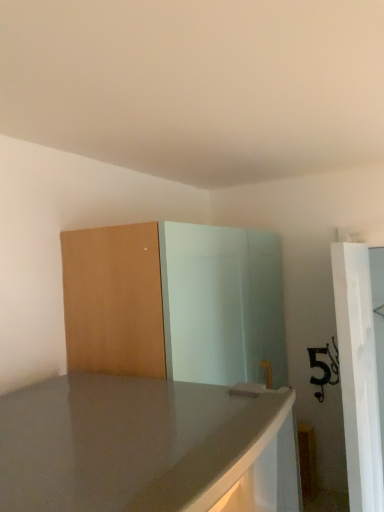
Question: From their relative heights in the image, would you say matte wood dresser at center is taller or shorter than white glossy screen door at right?

Choices:
 (A) tall
 (B) short

Answer: (B)

Question: Considering the positions of matte wood dresser at center and white glossy screen door at right in the image, is matte wood dresser at center wider or thinner than white glossy screen door at right?

Choices:
 (A) thin
 (B) wide

Answer: (B)

Question: Is matte wood dresser at center bigger or smaller than white glossy screen door at right?

Choices:
 (A) small
 (B) big

Answer: (B)

Question: Considering the positions of point (379, 455) and point (276, 350), is point (379, 455) closer or farther from the camera than point (276, 350)?

Choices:
 (A) farther
 (B) closer

Answer: (B)

Question: Is white glossy screen door at right inside the boundaries of matte wood dresser at center, or outside?

Choices:
 (A) outside
 (B) inside

Answer: (A)

Question: Visually, is white glossy screen door at right positioned to the left or to the right of matte wood dresser at center?

Choices:
 (A) left
 (B) right

Answer: (B)

Question: From a real-world perspective, is white glossy screen door at right positioned above or below matte wood dresser at center?

Choices:
 (A) below
 (B) above

Answer: (A)